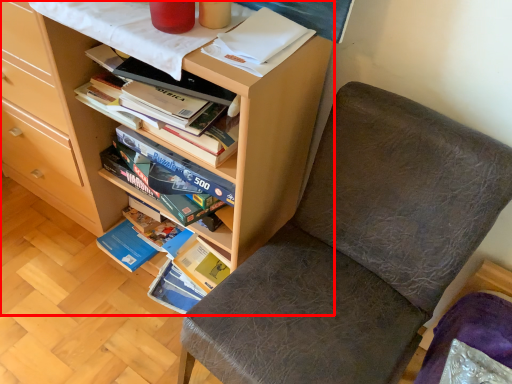
Question: From the image's perspective, what is the correct spatial relationship of bookcase (annotated by the red box) in relation to chair?

Choices:
 (A) above
 (B) below

Answer: (A)